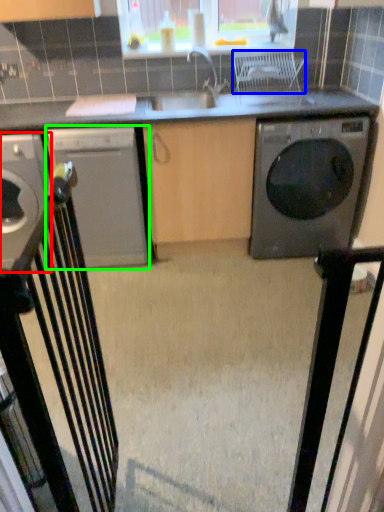
Question: Which object is the farthest from home appliance (highlighted by a red box)? Choose among these: chair (highlighted by a blue box) or home appliance (highlighted by a green box).

Choices:
 (A) chair
 (B) home appliance

Answer: (A)